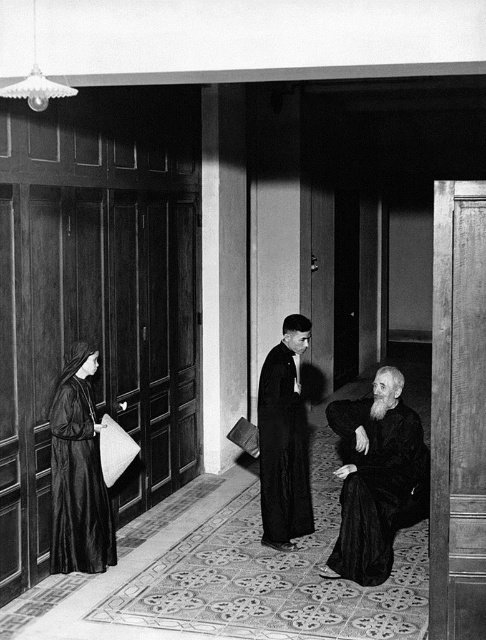
From the picture: You are an architect analyzing the layout of this historical building. You notice the black matte robe at lower right and the smooth black robe at center. Which robe is shorter in height?

The black matte robe at lower right has a lesser height compared to the smooth black robe at center, so the black matte robe at lower right is shorter.

You are an interior designer tasked with arranging furniture in this room. You notice the matte black robe at left and the smooth black robe at center. Which robe takes up more physical space in the image?

The smooth black robe at center occupies more space than the matte black robe at left according to the description.

You are a visitor in this religious building and need to pass between the black matte robe at lower right and the smooth black robe at center. Can you estimate if there is enough space to walk through without touching either?

The black matte robe at lower right might be wider than smooth black robe at center, so there may not be enough space to walk through safely. It is advisable to take a detour around the robes to avoid contact.